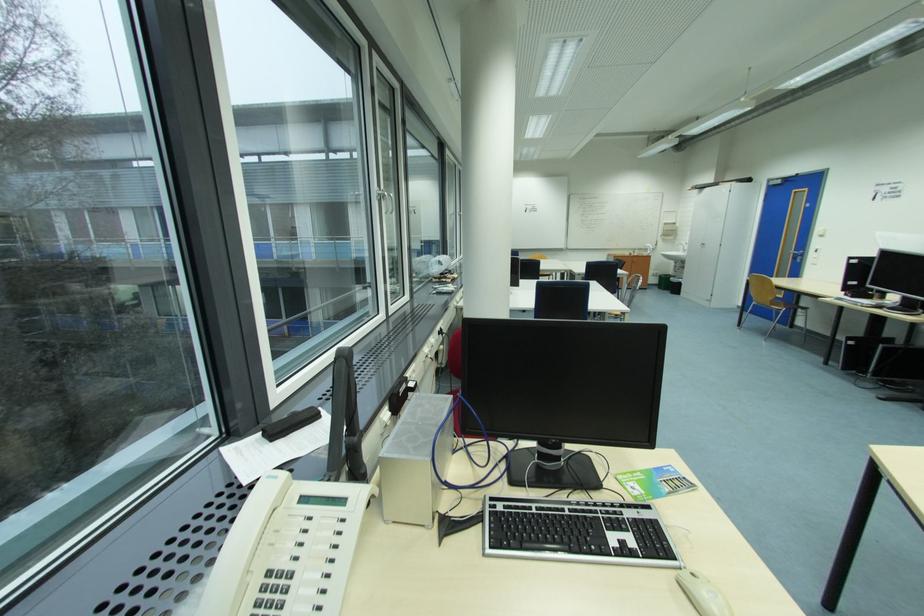
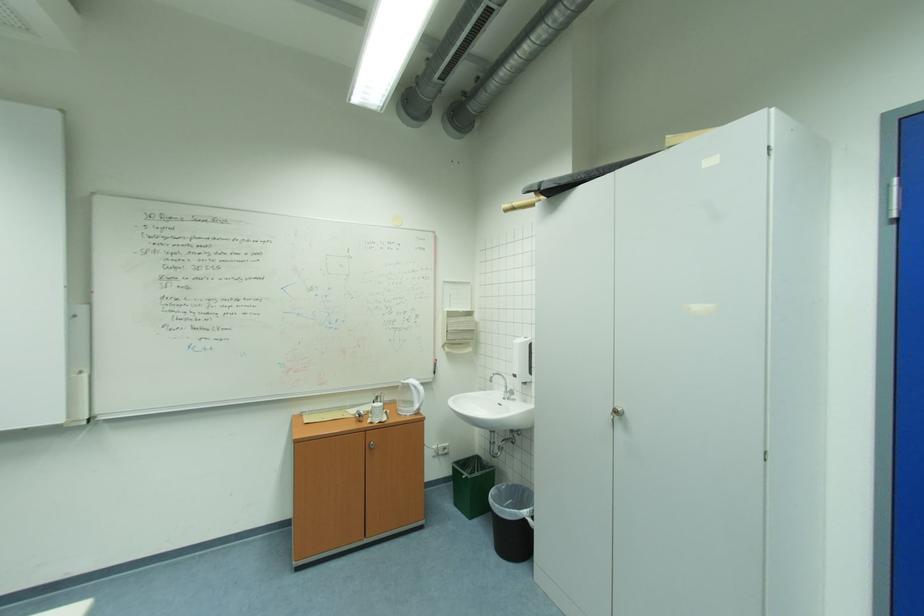
Locate, in the second image, the point that corresponds to (x=666, y=290) in the first image.

(464, 505)